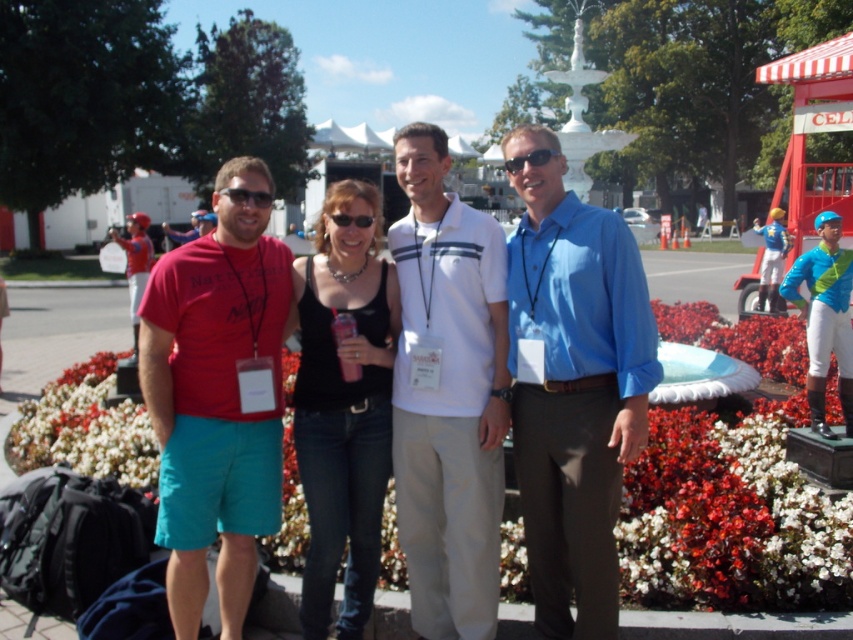
You are standing at the position of the camera. There is a black plastic sunglasses at center. Can you reach the sunglasses without moving? Please explain why.

The black plastic sunglasses at center are 3.52 meters away from the camera. Since you are at the camera position, you would need to move forward 3.52 meters to reach them, so you cannot reach them without moving.